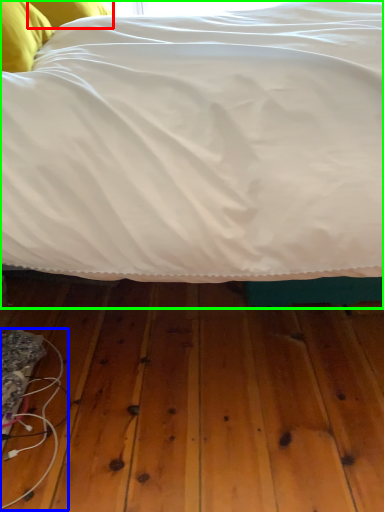
Question: Considering the real-world distances, which object is closest to pillow (highlighted by a red box)? wire (highlighted by a blue box) or bed (highlighted by a green box).

Choices:
 (A) wire
 (B) bed

Answer: (B)